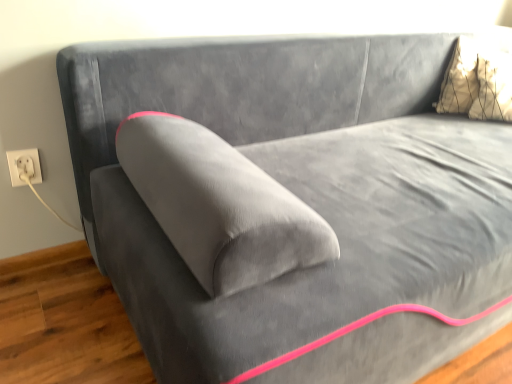
Question: Considering the relative positions of white cord at lower left and metallic gold pillow at upper right in the image provided, is white cord at lower left behind metallic gold pillow at upper right?

Choices:
 (A) no
 (B) yes

Answer: (A)

Question: From a real-world perspective, does white cord at lower left sit lower than metallic gold pillow at upper right?

Choices:
 (A) yes
 (B) no

Answer: (A)

Question: From the image's perspective, does white cord at lower left appear higher than metallic gold pillow at upper right?

Choices:
 (A) no
 (B) yes

Answer: (A)

Question: Is white cord at lower left smaller than metallic gold pillow at upper right?

Choices:
 (A) no
 (B) yes

Answer: (B)

Question: From the image's perspective, would you say white cord at lower left is shown under metallic gold pillow at upper right?

Choices:
 (A) no
 (B) yes

Answer: (B)

Question: Is white plastic socket at lower left to the left or to the right of metallic gold pillow at upper right in the image?

Choices:
 (A) right
 (B) left

Answer: (B)

Question: Is white plastic socket at lower left situated inside metallic gold pillow at upper right or outside?

Choices:
 (A) inside
 (B) outside

Answer: (B)

Question: Considering the positions of white plastic socket at lower left and metallic gold pillow at upper right in the image, is white plastic socket at lower left taller or shorter than metallic gold pillow at upper right?

Choices:
 (A) short
 (B) tall

Answer: (A)

Question: Looking at their shapes, would you say white plastic socket at lower left is wider or thinner than metallic gold pillow at upper right?

Choices:
 (A) wide
 (B) thin

Answer: (B)

Question: Looking at the image, does white cord at lower left seem bigger or smaller compared to white plastic socket at lower left?

Choices:
 (A) small
 (B) big

Answer: (B)

Question: Looking at their shapes, would you say white cord at lower left is wider or thinner than white plastic socket at lower left?

Choices:
 (A) thin
 (B) wide

Answer: (B)

Question: Considering the positions of white cord at lower left and white plastic socket at lower left in the image, is white cord at lower left taller or shorter than white plastic socket at lower left?

Choices:
 (A) short
 (B) tall

Answer: (B)

Question: Is point (72, 226) closer or farther from the camera than point (19, 162)?

Choices:
 (A) closer
 (B) farther

Answer: (B)

Question: Which is correct: metallic gold pillow at upper right is inside white cord at lower left, or outside of it?

Choices:
 (A) inside
 (B) outside

Answer: (B)

Question: Looking at the image, does metallic gold pillow at upper right seem bigger or smaller compared to white cord at lower left?

Choices:
 (A) big
 (B) small

Answer: (A)